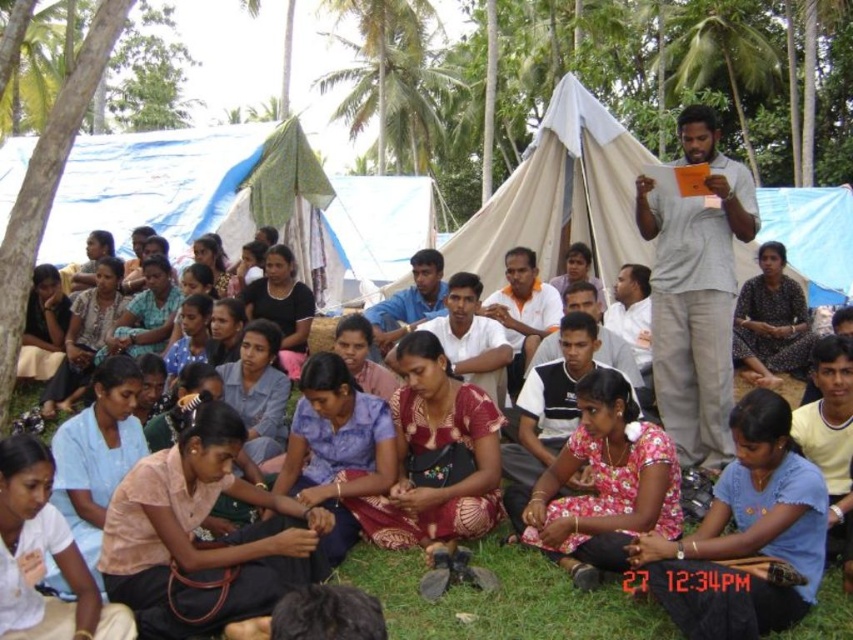
Question: Is floral fabric dress at lower center to the right of floral fabric dress at center from the viewer's perspective?

Choices:
 (A) yes
 (B) no

Answer: (A)

Question: Does white canvas tent at center appear on the right side of floral fabric dress at center?

Choices:
 (A) yes
 (B) no

Answer: (A)

Question: Which point is closer to the camera?

Choices:
 (A) (639, 536)
 (B) (341, 257)

Answer: (A)

Question: Which object appears farthest from the camera in this image?

Choices:
 (A) white canvas tent at center
 (B) floral fabric dress at center
 (C) blue tarpaulin tent at upper left
 (D) floral fabric dress at lower center

Answer: (C)

Question: Can you confirm if white canvas tent at center is positioned to the left of floral fabric dress at lower center?

Choices:
 (A) yes
 (B) no

Answer: (A)

Question: Which is farther from the floral fabric dress at center?

Choices:
 (A) floral fabric dress at lower center
 (B) white canvas tent at center
 (C) blue tarpaulin tent at upper left

Answer: (C)